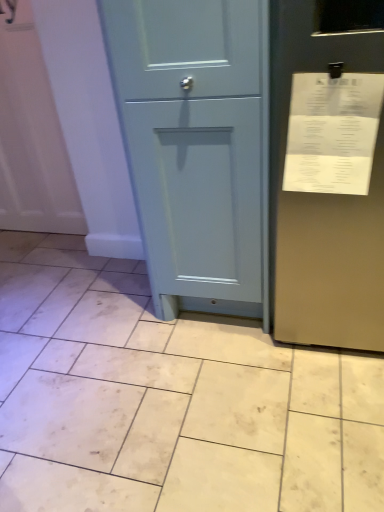
Question: Is white glossy tile at lower left, acting as the second ceramic tile starting from the bottom, closer to camera compared to matte blue cabinet at center?

Choices:
 (A) yes
 (B) no

Answer: (B)

Question: Can you confirm if white glossy tile at lower left, acting as the second ceramic tile starting from the bottom, is bigger than matte blue cabinet at center?

Choices:
 (A) yes
 (B) no

Answer: (B)

Question: Is white glossy tile at lower left, acting as the second ceramic tile starting from the bottom, thinner than matte blue cabinet at center?

Choices:
 (A) yes
 (B) no

Answer: (A)

Question: Is white glossy tile at lower left, which is the 1th ceramic tile from top to bottom, not inside matte blue cabinet at center?

Choices:
 (A) yes
 (B) no

Answer: (A)

Question: Is white glossy tile at lower left, acting as the second ceramic tile starting from the bottom, at the left side of matte blue cabinet at center?

Choices:
 (A) no
 (B) yes

Answer: (B)

Question: Is white glossy tile at lower left, which is the 1th ceramic tile from top to bottom, far from matte blue cabinet at center?

Choices:
 (A) yes
 (B) no

Answer: (A)

Question: Is white paper receipt at upper right taller than white glossy tile at lower left, which is the 1th ceramic tile from top to bottom?

Choices:
 (A) no
 (B) yes

Answer: (B)

Question: Would you consider white paper receipt at upper right to be distant from white glossy tile at lower left, acting as the second ceramic tile starting from the bottom?

Choices:
 (A) no
 (B) yes

Answer: (B)

Question: Is white paper receipt at upper right positioned before white glossy tile at lower left, acting as the second ceramic tile starting from the bottom?

Choices:
 (A) yes
 (B) no

Answer: (A)

Question: From the image's perspective, is white paper receipt at upper right beneath white glossy tile at lower left, acting as the second ceramic tile starting from the bottom?

Choices:
 (A) no
 (B) yes

Answer: (A)

Question: Can you see white paper receipt at upper right touching white glossy tile at lower left, acting as the second ceramic tile starting from the bottom?

Choices:
 (A) yes
 (B) no

Answer: (B)

Question: Can white glossy tile at lower left, acting as the second ceramic tile starting from the bottom, be found inside white paper receipt at upper right?

Choices:
 (A) no
 (B) yes

Answer: (A)

Question: Is beige matte tile at center, which is counted as the second ceramic tile, starting from the top, facing away from white paper receipt at upper right?

Choices:
 (A) yes
 (B) no

Answer: (B)